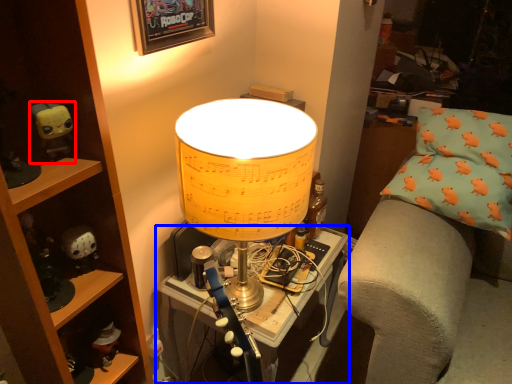
Question: Which object is further to the camera taking this photo, toy (highlighted by a red box) or table (highlighted by a blue box)?

Choices:
 (A) toy
 (B) table

Answer: (A)